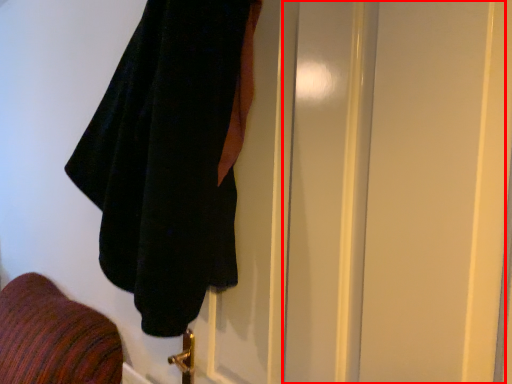
Question: From the image's perspective, what is the correct spatial positioning of screen door (annotated by the red box) in reference to towel?

Choices:
 (A) below
 (B) above

Answer: (A)